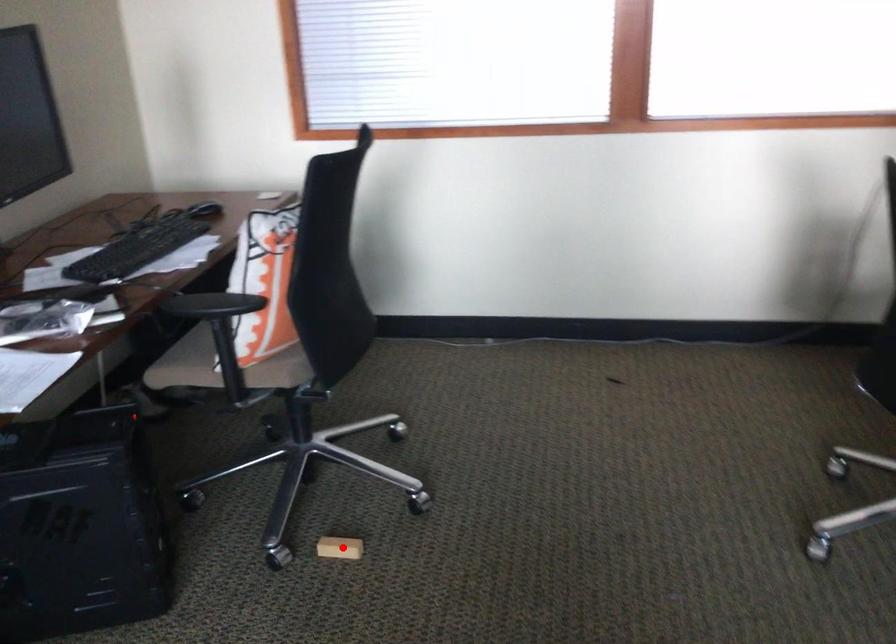
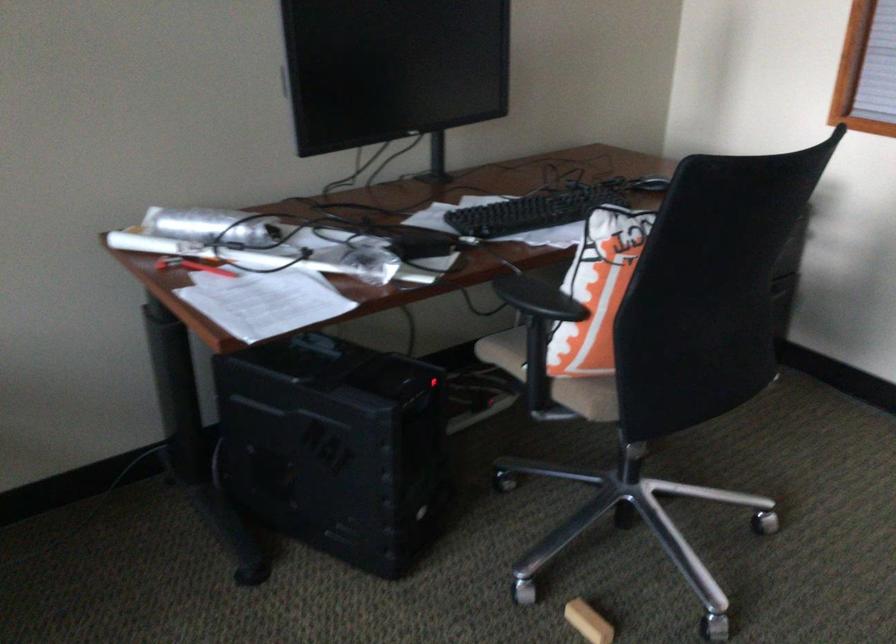
Where in the second image is the point corresponding to the highlighted location from the first image?

(588, 621)